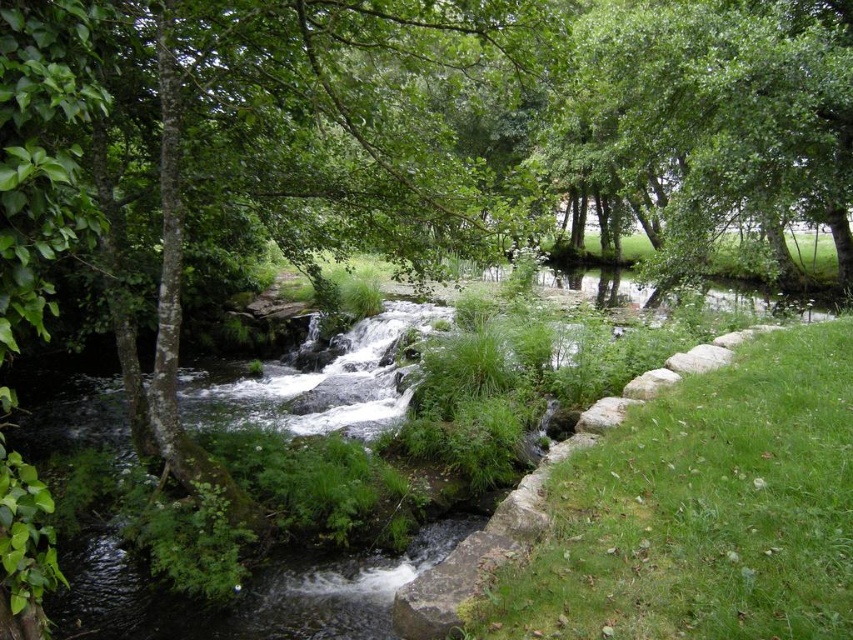
You are standing at the edge of the stream and want to take a photo of the green leafy tree at upper center. To avoid getting your camera wet, should you position yourself on the green grass at lower right or stay where you are?

The green grass at lower right is located below the green leafy tree at upper center, so positioning yourself on the green grass at lower right would place you closer to the tree and keep your camera dry.

Looking at this image, you are standing at the edge of the stream and want to walk along the stone path while keeping both the green grass at lower right and the green leafy tree at upper center in your view. Which object will require you to turn your head more to see?

The green grass at lower right has a lesser width compared to the green leafy tree at upper center, so you will need to turn your head more to see the green grass at lower right because it is narrower and might be positioned further away, requiring a more precise angle to keep it in view.

You are a hiker standing at the edge of the stream and want to take a photo of both the green grass at lower right and the green leafy tree at upper center. Which object will appear smaller in your photo?

The green grass at lower right will appear smaller in the photo because it occupies less space than the green leafy tree at upper center.